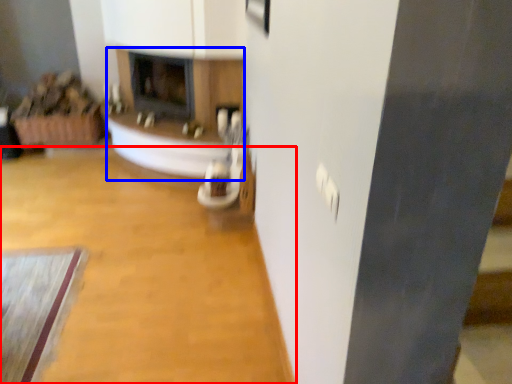
Question: Which point is closer to the camera, plain (highlighted by a red box) or fireplace (highlighted by a blue box)?

Choices:
 (A) plain
 (B) fireplace

Answer: (A)